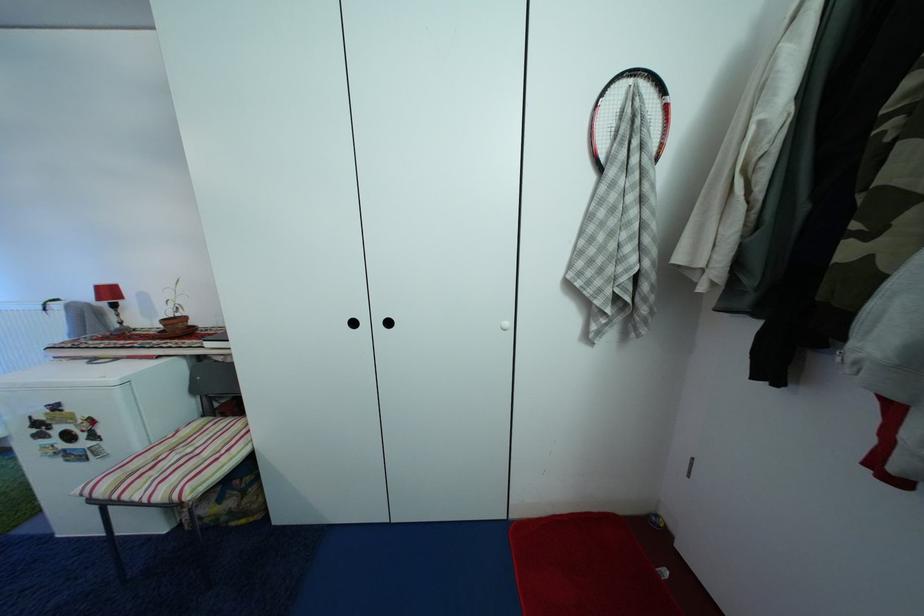
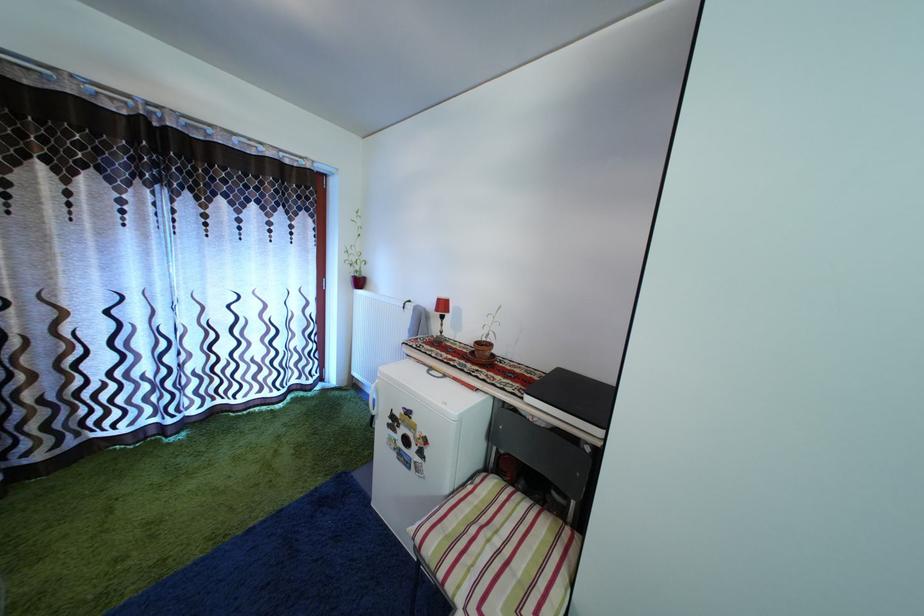
Find the pixel in the second image that matches point 106,294 in the first image.

(446, 308)